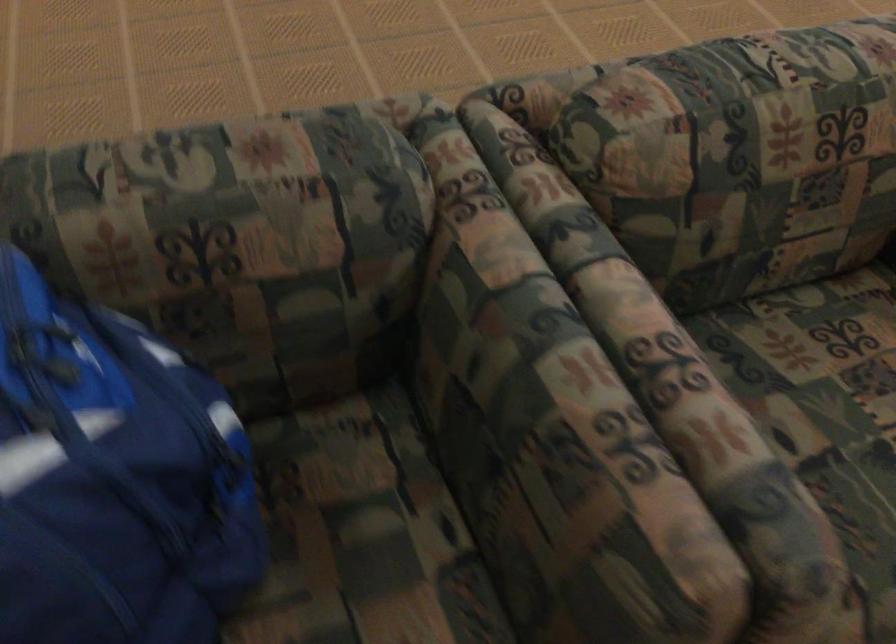
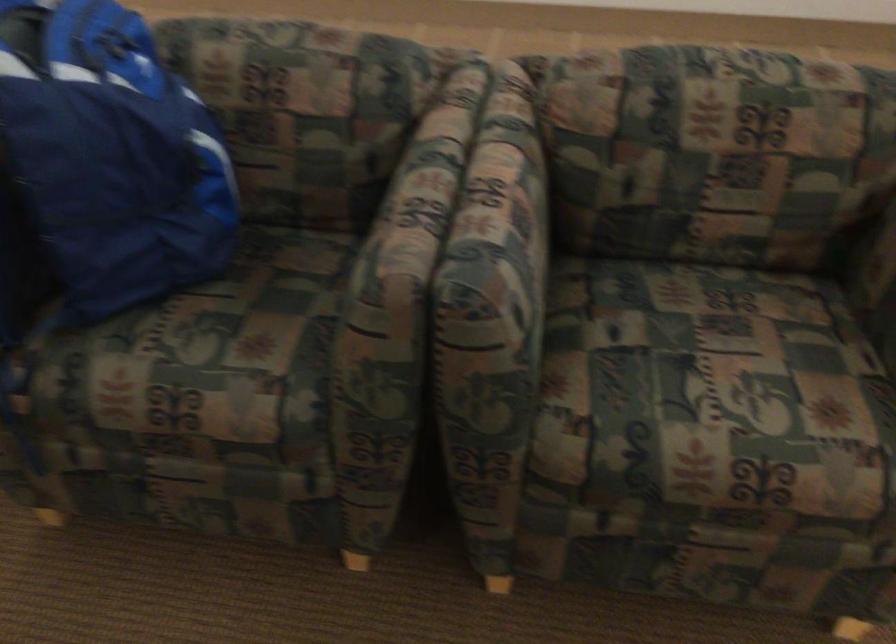
Locate, in the second image, the point that corresponds to point 135,543 in the first image.

(112, 155)